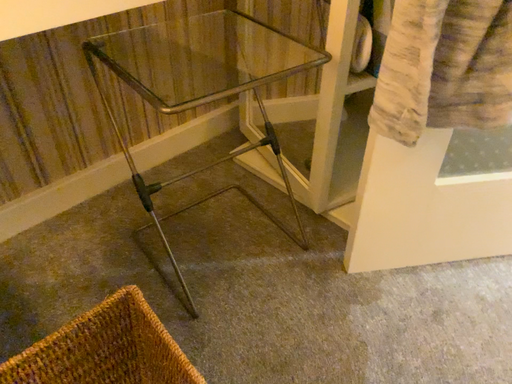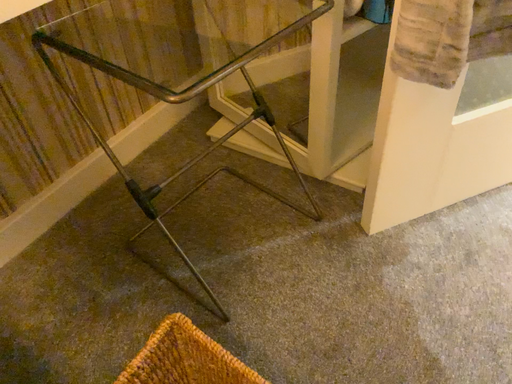
Question: How did the camera likely rotate when shooting the video?

Choices:
 (A) rotated left
 (B) rotated right

Answer: (B)